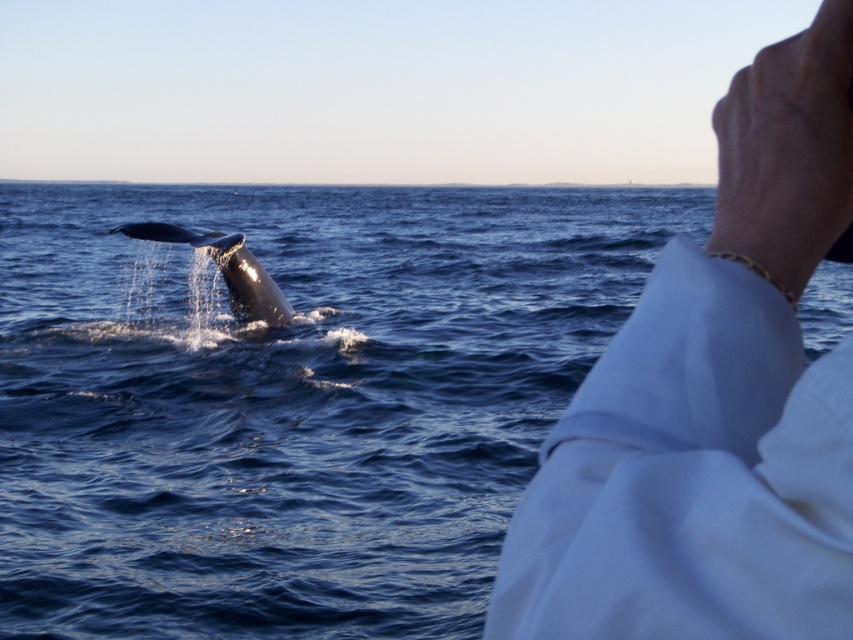
Question: Which point appears closest to the camera in this image?

Choices:
 (A) (706, 221)
 (B) (746, 388)

Answer: (B)

Question: Which point is farther to the camera?

Choices:
 (A) (747, 552)
 (B) (57, 428)

Answer: (B)

Question: Can you confirm if blue water at whale left is positioned to the left of gray smooth whale at left?

Choices:
 (A) yes
 (B) no

Answer: (B)

Question: Can you confirm if blue water at whale left is smaller than gray smooth whale at left?

Choices:
 (A) yes
 (B) no

Answer: (B)

Question: Which is nearer to the white cloth at upper right?

Choices:
 (A) blue water at whale left
 (B) gray smooth whale at left

Answer: (B)

Question: Can you confirm if blue water at whale left is positioned to the right of gray smooth whale at left?

Choices:
 (A) yes
 (B) no

Answer: (A)